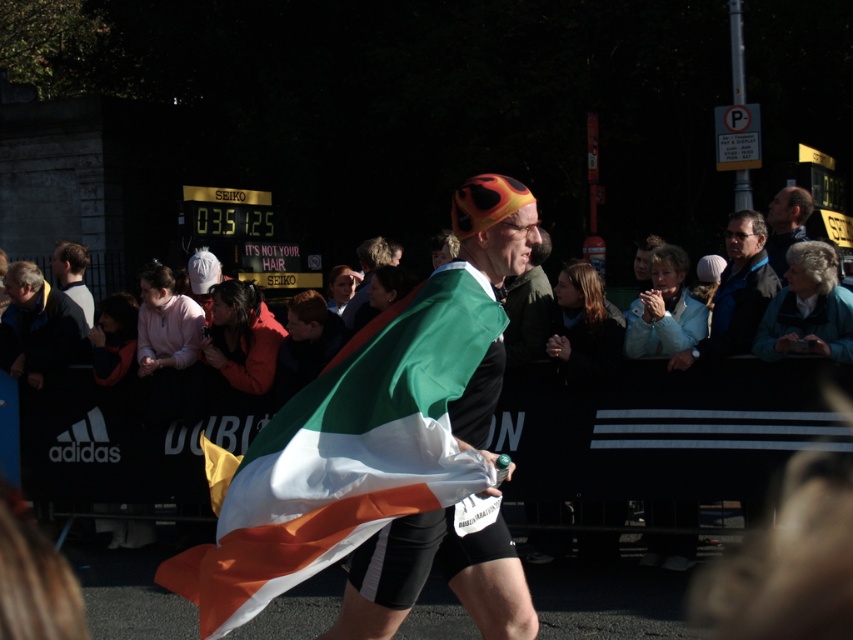
Question: Is the position of matte black jacket at upper right less distant than that of gray fabric jacket at left?

Choices:
 (A) no
 (B) yes

Answer: (B)

Question: Which point is closer to the camera taking this photo?

Choices:
 (A) (67, 284)
 (B) (380, 515)
 (C) (469, 232)
 (D) (769, 246)

Answer: (B)

Question: Which object appears farthest from the camera in this image?

Choices:
 (A) gray fabric jacket at left
 (B) irish flag at center
 (C) matte black jacket at upper right
 (D) green fabric flag at center

Answer: (A)

Question: Based on their relative distances, which object is farther from the green fabric flag at center?

Choices:
 (A) matte black jacket at upper right
 (B) gray fabric jacket at left

Answer: (B)

Question: Is green fabric flag at center to the right of gray fabric jacket at left from the viewer's perspective?

Choices:
 (A) yes
 (B) no

Answer: (A)

Question: Can you confirm if matte black jacket at upper right is positioned to the right of gray fabric jacket at left?

Choices:
 (A) no
 (B) yes

Answer: (B)